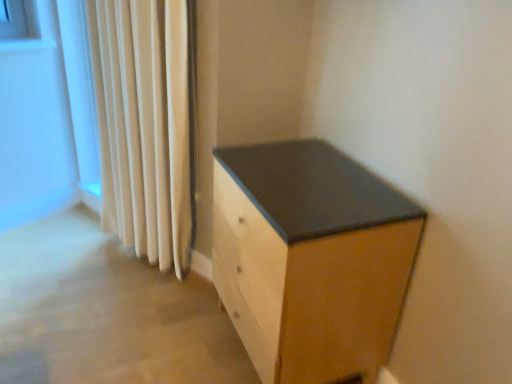
Question: From the image's perspective, is matte black drawer at center beneath beige fabric curtain at left?

Choices:
 (A) yes
 (B) no

Answer: (A)

Question: Could you tell me if matte black drawer at center is facing beige fabric curtain at left?

Choices:
 (A) yes
 (B) no

Answer: (B)

Question: Is matte black drawer at center looking in the opposite direction of beige fabric curtain at left?

Choices:
 (A) yes
 (B) no

Answer: (B)

Question: Considering the relative sizes of matte black drawer at center and beige fabric curtain at left in the image provided, is matte black drawer at center bigger than beige fabric curtain at left?

Choices:
 (A) yes
 (B) no

Answer: (A)

Question: Is matte black drawer at center surrounding beige fabric curtain at left?

Choices:
 (A) no
 (B) yes

Answer: (A)

Question: Is matte black drawer at center thinner than beige fabric curtain at left?

Choices:
 (A) yes
 (B) no

Answer: (B)

Question: Can you confirm if beige fabric curtain at left is thinner than matte black drawer at center?

Choices:
 (A) yes
 (B) no

Answer: (A)

Question: Does beige fabric curtain at left have a lesser height compared to matte black drawer at center?

Choices:
 (A) yes
 (B) no

Answer: (B)

Question: Does beige fabric curtain at left appear on the right side of matte black drawer at center?

Choices:
 (A) no
 (B) yes

Answer: (A)

Question: From the image's perspective, does beige fabric curtain at left appear lower than matte black drawer at center?

Choices:
 (A) yes
 (B) no

Answer: (B)

Question: From the image's perspective, does beige fabric curtain at left appear higher than matte black drawer at center?

Choices:
 (A) yes
 (B) no

Answer: (A)

Question: From a real-world perspective, is beige fabric curtain at left located higher than matte black drawer at center?

Choices:
 (A) yes
 (B) no

Answer: (A)

Question: From a real-world perspective, is matte black drawer at center physically located above or below beige fabric curtain at left?

Choices:
 (A) above
 (B) below

Answer: (B)